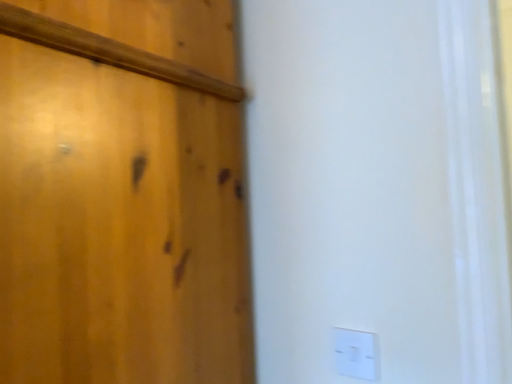
Question: Does point (16, 357) appear closer or farther from the camera than point (356, 349)?

Choices:
 (A) farther
 (B) closer

Answer: (B)

Question: From a real-world perspective, is wooden door at left positioned above or below white plastic light switch at lower right?

Choices:
 (A) below
 (B) above

Answer: (B)

Question: From the image's perspective, is wooden door at left located above or below white plastic light switch at lower right?

Choices:
 (A) above
 (B) below

Answer: (A)

Question: Is white plastic light switch at lower right inside or outside of wooden door at left?

Choices:
 (A) inside
 (B) outside

Answer: (B)

Question: Looking at the image, does white plastic light switch at lower right seem bigger or smaller compared to wooden door at left?

Choices:
 (A) small
 (B) big

Answer: (A)

Question: Considering the positions of white plastic light switch at lower right and wooden door at left in the image, is white plastic light switch at lower right taller or shorter than wooden door at left?

Choices:
 (A) tall
 (B) short

Answer: (B)

Question: Looking at their shapes, would you say white plastic light switch at lower right is wider or thinner than wooden door at left?

Choices:
 (A) thin
 (B) wide

Answer: (A)